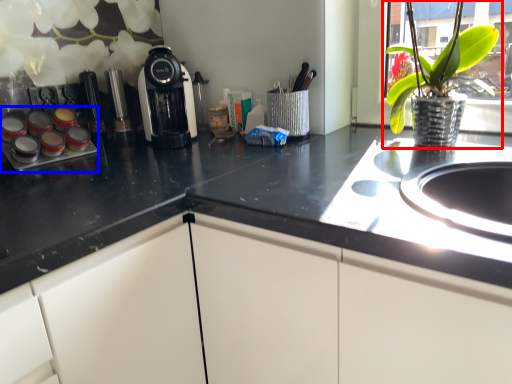
Question: Which of the following is the closest to the observer, houseplant (highlighted by a red box) or appliance (highlighted by a blue box)?

Choices:
 (A) houseplant
 (B) appliance

Answer: (A)